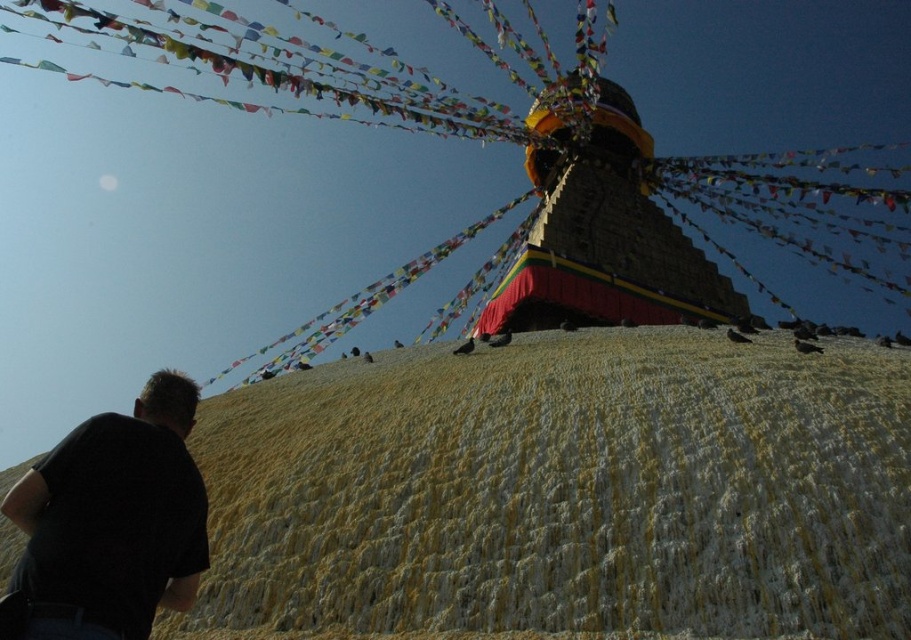
Which is below, yellow textured mound at center or black cotton shirt at lower left?

black cotton shirt at lower left is below.

Between yellow textured mound at center and black cotton shirt at lower left, which one is positioned higher?

yellow textured mound at center

Which is in front, point (695, 429) or point (165, 492)?

Point (165, 492)

The height and width of the screenshot is (640, 911). I want to click on yellow textured mound at center, so click(x=563, y=493).